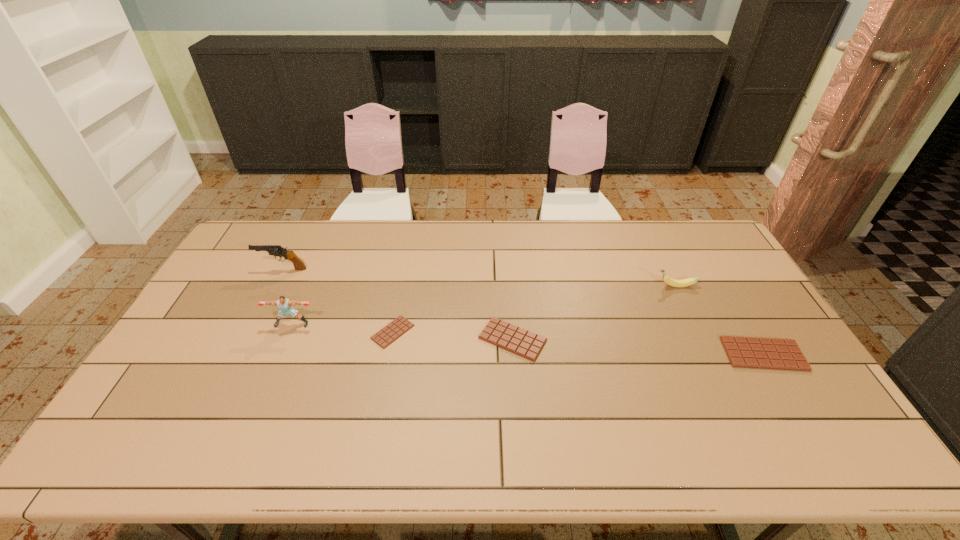
You are a GUI agent. You are given a task and a screenshot of the screen. Output one action in this format:
    pyautogui.click(x=<x>, y=<y>)
    Task: Click on the object that is at the right edge
    This screenshot has width=960, height=540.
    Given the screenshot: What is the action you would take?
    pyautogui.click(x=744, y=352)

In the image, there is a desktop. Identify the location of blank space at the far edge. The height and width of the screenshot is (540, 960). (563, 229).

I want to click on vacant space at the near edge of the desktop, so click(x=569, y=410).

Find the location of a particular element. vacant space at the left edge of the desktop is located at coordinates (201, 308).

Locate an element on the screen. Image resolution: width=960 pixels, height=540 pixels. free spot at the right edge of the desktop is located at coordinates (739, 273).

The image size is (960, 540). In the image, there is a desktop. Find the location of `vacant space at the far left corner`. vacant space at the far left corner is located at coordinates (265, 256).

Where is `vacant space at the near left corner of the desktop`? This screenshot has width=960, height=540. vacant space at the near left corner of the desktop is located at coordinates (186, 406).

The image size is (960, 540). Find the location of `unoccupied area between the second shortest candy bar and the rightmost candy bar`. unoccupied area between the second shortest candy bar and the rightmost candy bar is located at coordinates (637, 347).

I want to click on vacant area that lies between the rightmost candy bar and the second shortest object, so click(x=637, y=347).

Identify the location of free space between the gun and the shortest candy bar. Image resolution: width=960 pixels, height=540 pixels. (338, 300).